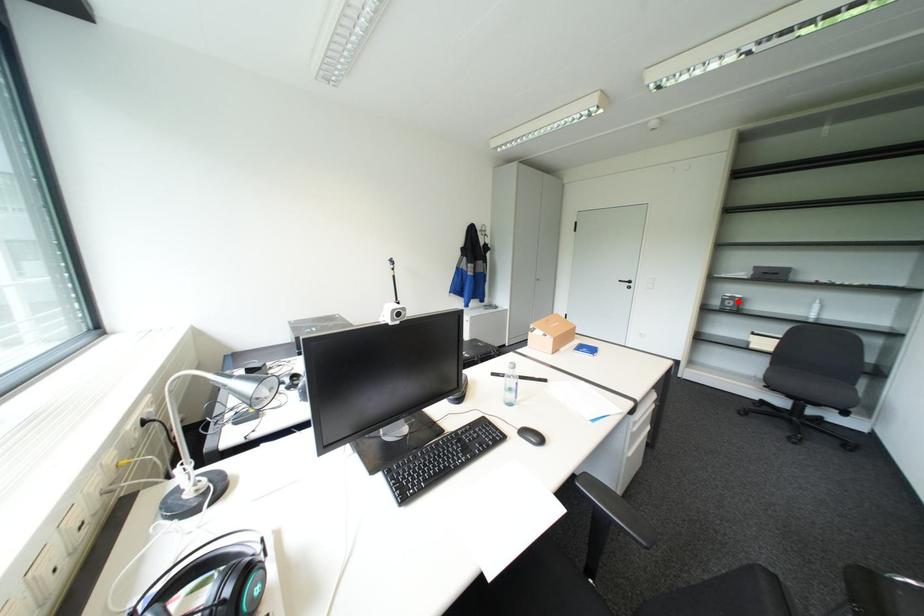
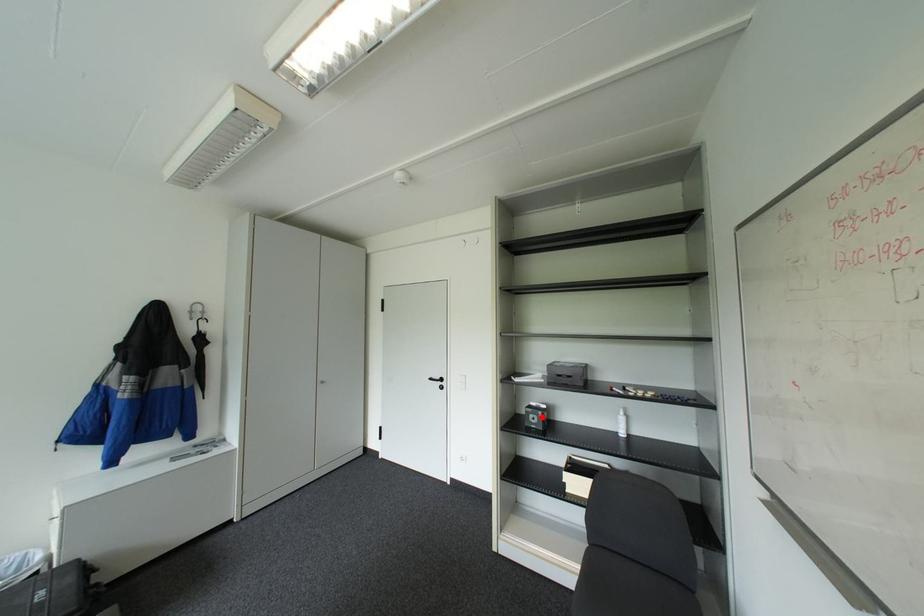
I am providing you with two images of the same scene from different viewpoints. A red point is marked on the first image and another point is marked on the second image. Do the highlighted points in image1 and image2 indicate the same real-world spot?

Yes